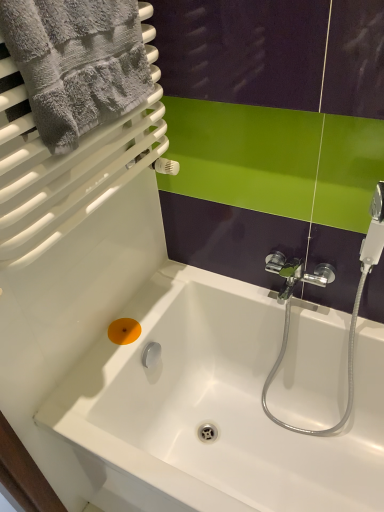
Question: Is orange matte soap at lower left turned away from white glossy bathtub at center?

Choices:
 (A) yes
 (B) no

Answer: (A)

Question: Can you confirm if orange matte soap at lower left is wider than white glossy bathtub at center?

Choices:
 (A) yes
 (B) no

Answer: (B)

Question: Is orange matte soap at lower left to the right of white glossy bathtub at center from the viewer's perspective?

Choices:
 (A) yes
 (B) no

Answer: (B)

Question: From the image's perspective, does orange matte soap at lower left appear lower than white glossy bathtub at center?

Choices:
 (A) no
 (B) yes

Answer: (A)

Question: Does orange matte soap at lower left touch white glossy bathtub at center?

Choices:
 (A) no
 (B) yes

Answer: (A)

Question: Considering the positions of point (64, 40) and point (294, 418), is point (64, 40) closer or farther from the camera than point (294, 418)?

Choices:
 (A) farther
 (B) closer

Answer: (B)

Question: Considering their positions, is gray fluffy towel at upper left located in front of or behind white glossy bathtub at center?

Choices:
 (A) front
 (B) behind

Answer: (A)

Question: Is gray fluffy towel at upper left to the left or to the right of white glossy bathtub at center in the image?

Choices:
 (A) right
 (B) left

Answer: (B)

Question: Choose the correct answer: Is gray fluffy towel at upper left inside white glossy bathtub at center or outside it?

Choices:
 (A) inside
 (B) outside

Answer: (B)

Question: Choose the correct answer: Is gray fluffy towel at upper left inside orange matte soap at lower left or outside it?

Choices:
 (A) inside
 (B) outside

Answer: (B)

Question: Considering their positions, is gray fluffy towel at upper left located in front of or behind orange matte soap at lower left?

Choices:
 (A) front
 (B) behind

Answer: (A)

Question: Considering the positions of gray fluffy towel at upper left and orange matte soap at lower left in the image, is gray fluffy towel at upper left taller or shorter than orange matte soap at lower left?

Choices:
 (A) tall
 (B) short

Answer: (A)

Question: Considering the positions of gray fluffy towel at upper left and orange matte soap at lower left in the image, is gray fluffy towel at upper left wider or thinner than orange matte soap at lower left?

Choices:
 (A) wide
 (B) thin

Answer: (A)

Question: From the image's perspective, is white glossy bathtub at center above or below orange matte soap at lower left?

Choices:
 (A) above
 (B) below

Answer: (B)

Question: In the image, is white glossy bathtub at center positioned in front of or behind orange matte soap at lower left?

Choices:
 (A) behind
 (B) front

Answer: (B)